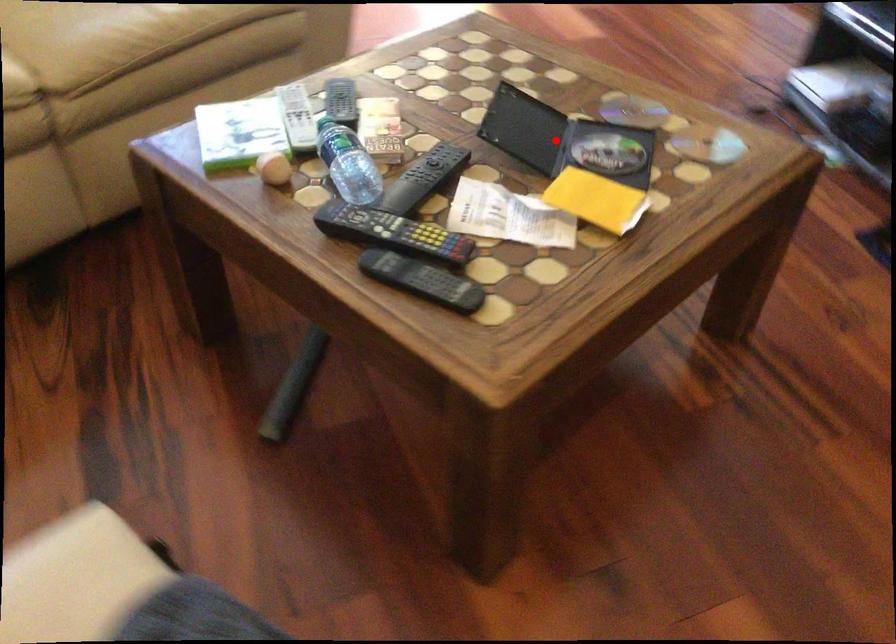
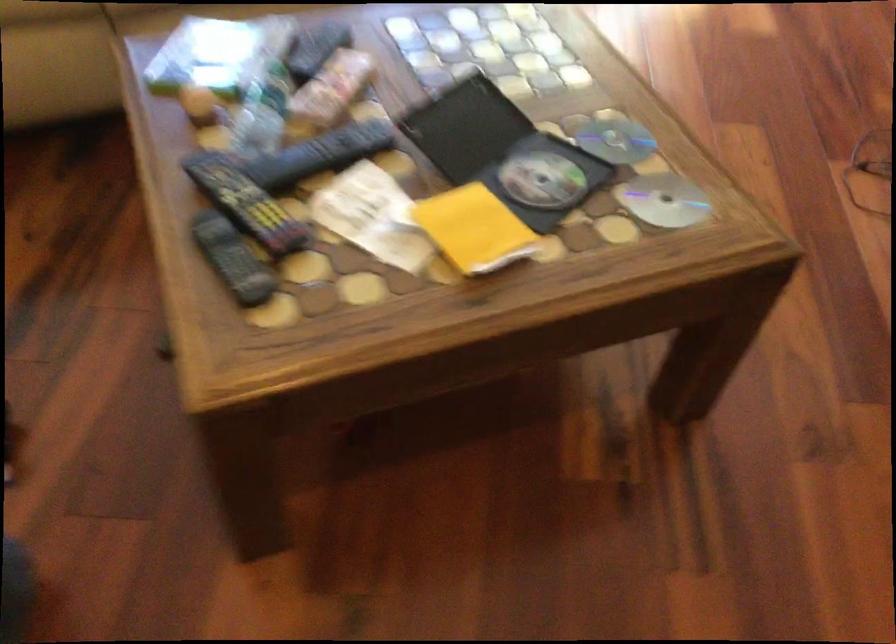
Locate, in the second image, the point that corresponds to the highlighted location in the first image.

(503, 152)